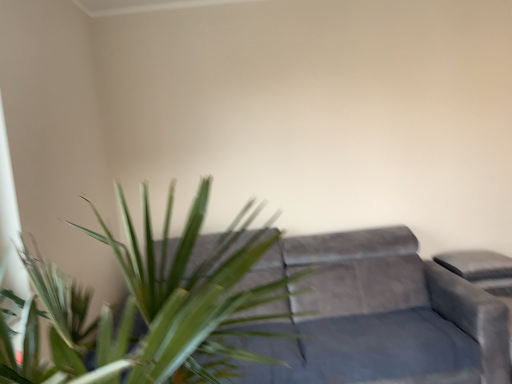
This screenshot has height=384, width=512. What do you see at coordinates (376, 315) in the screenshot?
I see `velvet grey couch at center` at bounding box center [376, 315].

Find the location of a particular element. velvet grey couch at center is located at coordinates (376, 315).

The height and width of the screenshot is (384, 512). I want to click on velvet grey couch at center, so click(376, 315).